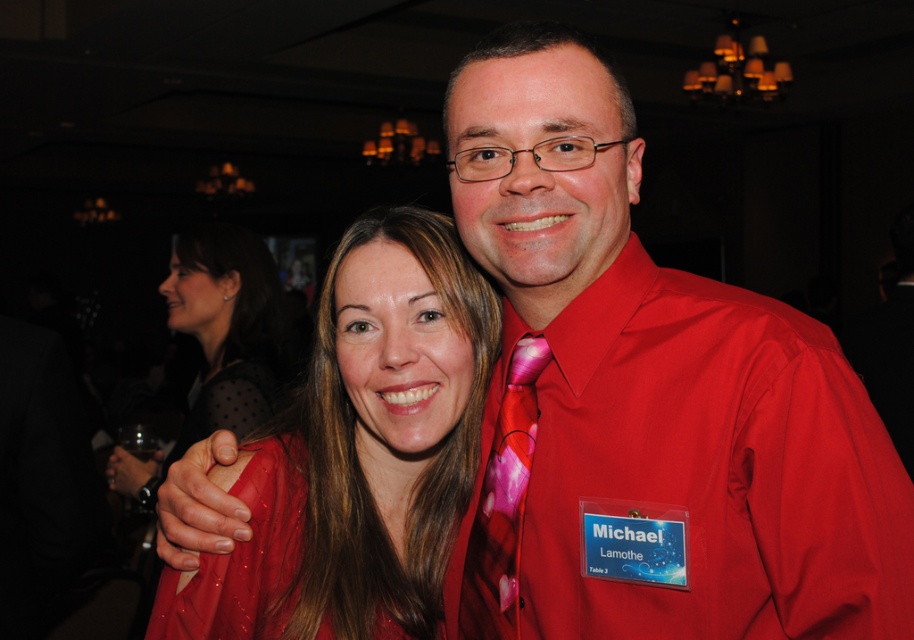
You are a photographer at the event and want to ensure both the shiny red dress shirt at center and the shiny red dress at center are clearly visible in the photo. Given their sizes, which one might require more careful framing to avoid being overshadowed?

The shiny red dress shirt at center is larger in size compared to the shiny red dress at center, so the dress might need more careful framing to avoid being overshadowed by the larger shirt.

You are standing in front of the image and want to touch both points marked in the scene. Which point would you need to reach out further to touch, point at position (360, 445) or point at position (118, 456)?

Point at position (118, 456) is further away from the viewer than point at position (360, 445), so you would need to reach out further to touch point at position (118, 456).